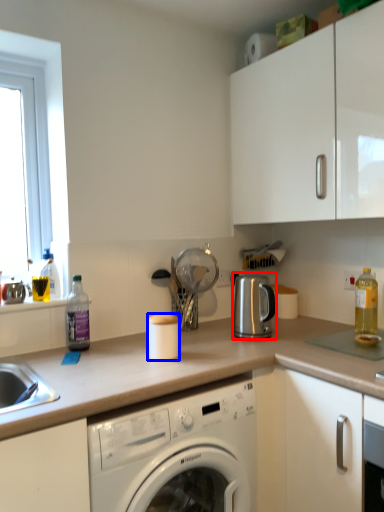
Question: Which object is further to the camera taking this photo, appliance (highlighted by a red box) or appliance (highlighted by a blue box)?

Choices:
 (A) appliance
 (B) appliance

Answer: (A)